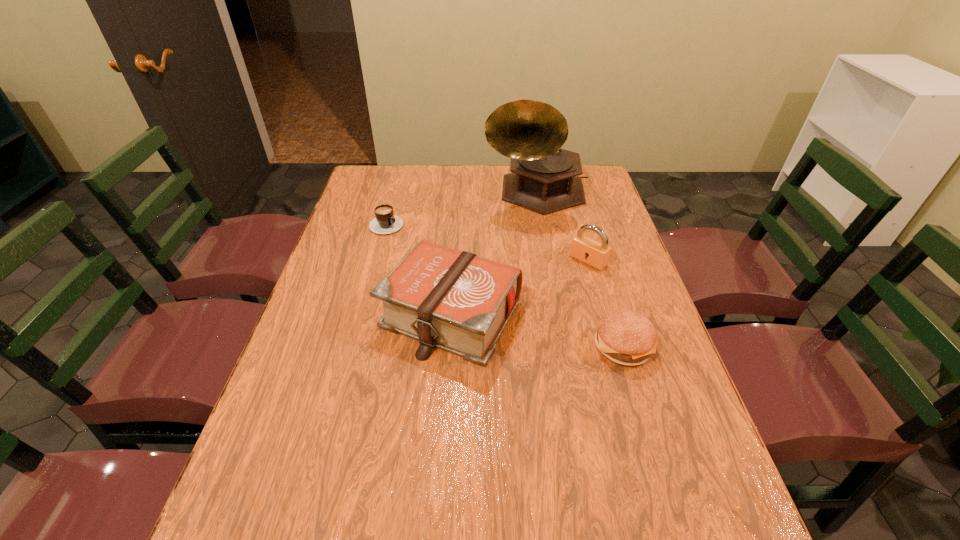
The height and width of the screenshot is (540, 960). I want to click on unoccupied position between the Bible and the phonograph record, so click(x=493, y=253).

Locate an element on the screen. The height and width of the screenshot is (540, 960). blank region between the padlock and the tallest object is located at coordinates (562, 226).

Locate an element on the screen. empty location between the fourth tallest object and the padlock is located at coordinates (606, 303).

Where is `free area in between the padlock and the tallest object`? This screenshot has width=960, height=540. free area in between the padlock and the tallest object is located at coordinates (562, 226).

Identify the location of vacant area that lies between the hamburger and the padlock. (606, 303).

You are a GUI agent. You are given a task and a screenshot of the screen. Output one action in this format:
    pyautogui.click(x=<x>, y=<y>)
    Task: Click on the vacant space that is in between the padlock and the tallest object
    The height and width of the screenshot is (540, 960).
    Given the screenshot: What is the action you would take?
    pyautogui.click(x=562, y=226)

I want to click on object that is the fourth closest to the cappuccino, so click(625, 337).

Where is `object that is the closest to the hamburger`? The image size is (960, 540). object that is the closest to the hamburger is located at coordinates (457, 301).

Identify the location of vacant position in the image that satisfies the following two spatial constraints: 1. on the back side of the cappuccino; 2. on the left side of the phonograph record. The image size is (960, 540). (396, 192).

The width and height of the screenshot is (960, 540). What are the coordinates of `vacant area that satisfies the following two spatial constraints: 1. on the front side of the hamburger; 2. on the right side of the padlock` in the screenshot? It's located at (612, 346).